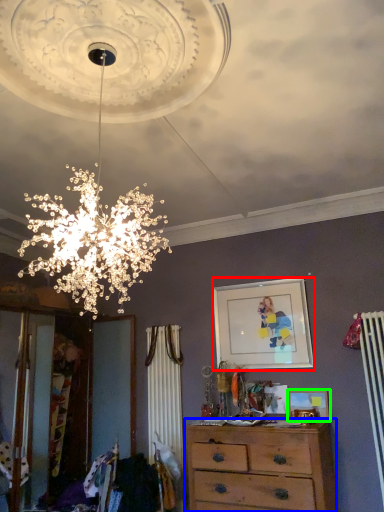
Question: Which is nearer to the picture frame (highlighted by a red box)? chest of drawers (highlighted by a blue box) or picture frame (highlighted by a green box).

Choices:
 (A) chest of drawers
 (B) picture frame

Answer: (B)